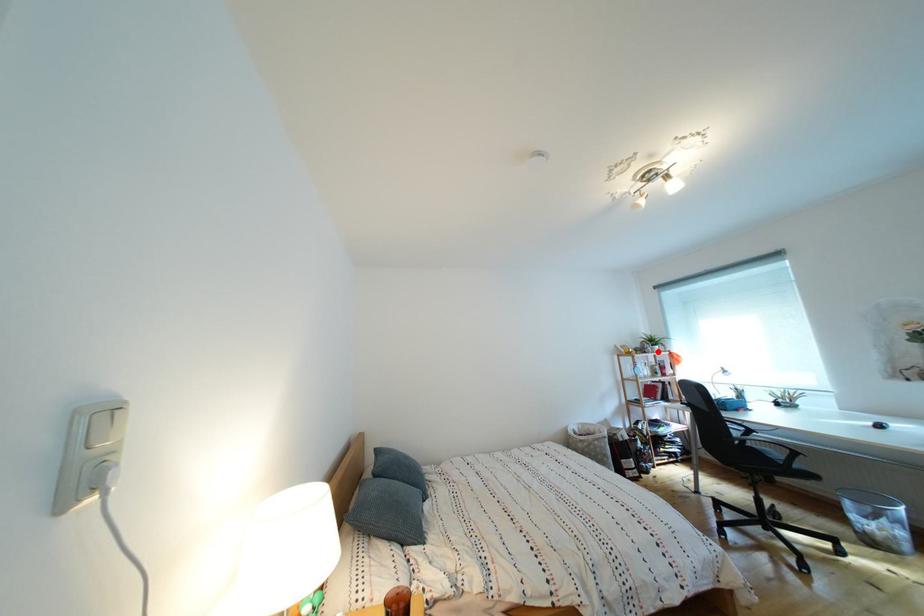
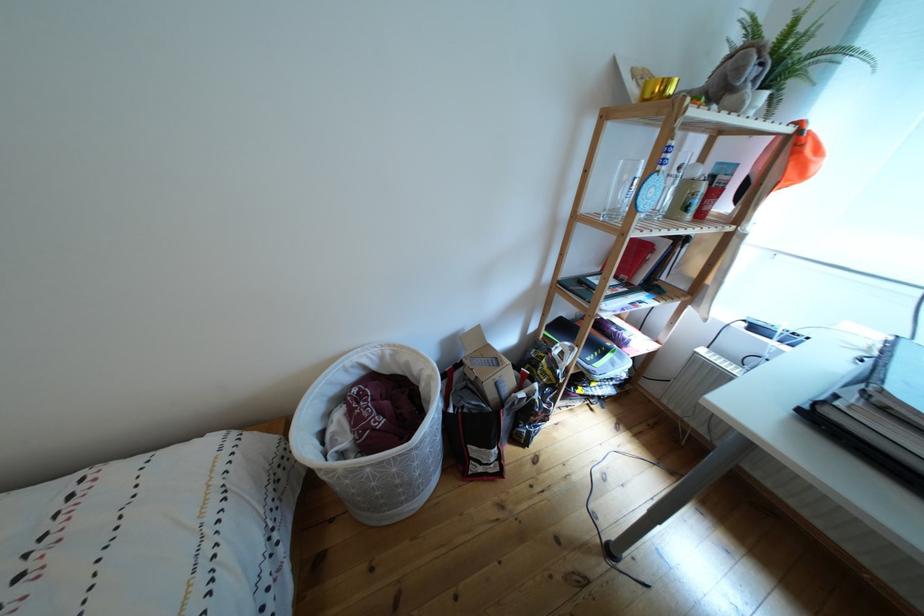
Where in the second image is the point corresponding to the highlighted location from the first image?

(762, 77)